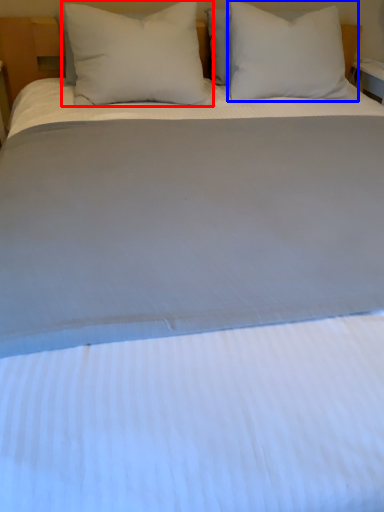
Question: Which object is closer to the camera taking this photo, pillow (highlighted by a red box) or pillow (highlighted by a blue box)?

Choices:
 (A) pillow
 (B) pillow

Answer: (A)